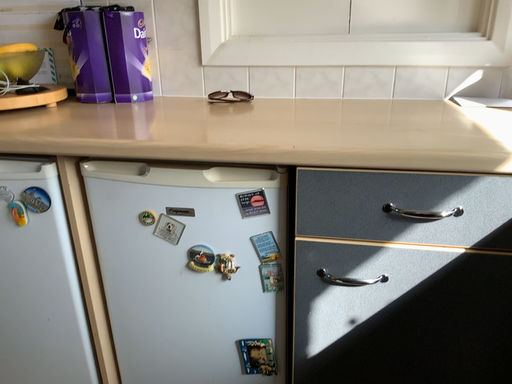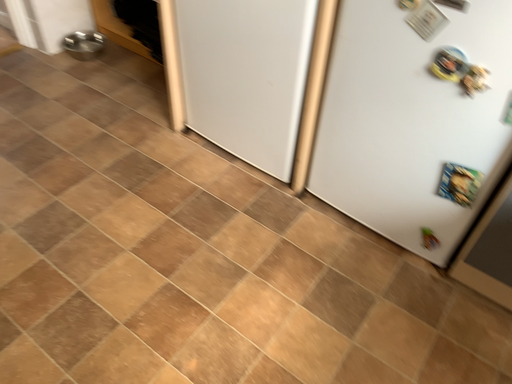
Question: How did the camera likely rotate when shooting the video?

Choices:
 (A) rotated downward
 (B) rotated upward

Answer: (A)